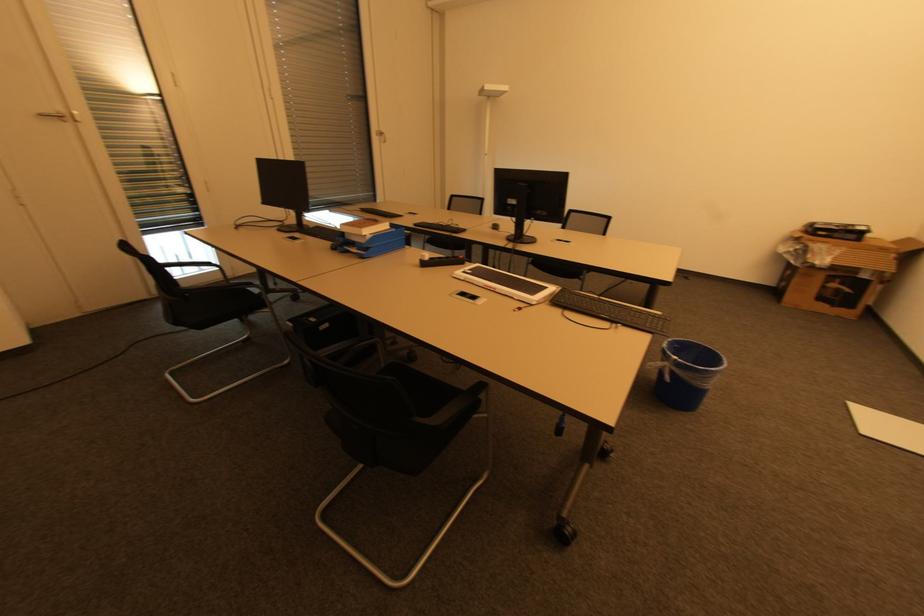
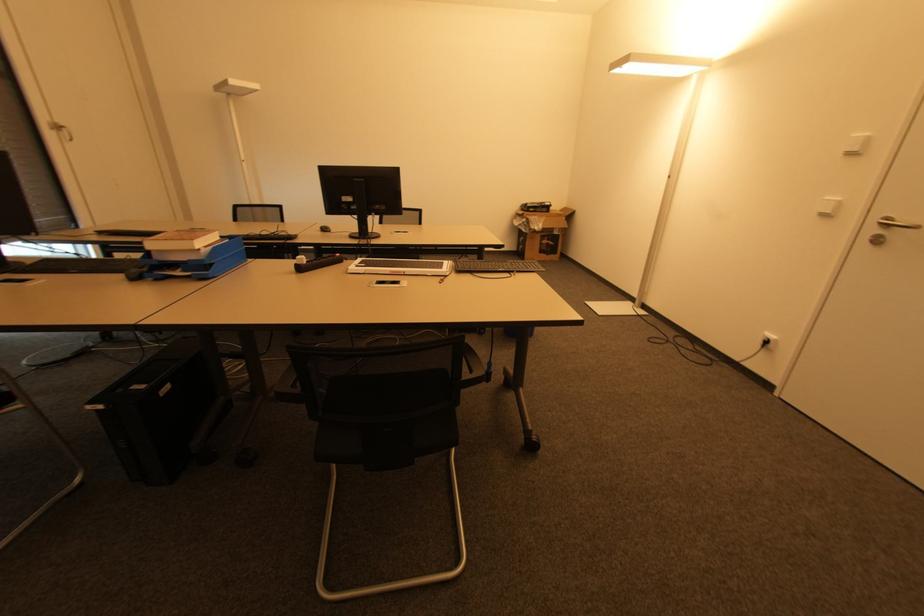
Where in the second image is the point corresponding to (x=312, y=228) from the first image?

(30, 264)